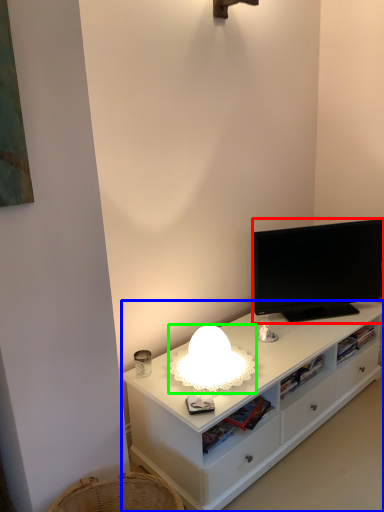
Question: Which is nearer to the television (highlighted by a red box)? cabinetry (highlighted by a blue box) or lamp (highlighted by a green box).

Choices:
 (A) cabinetry
 (B) lamp

Answer: (A)